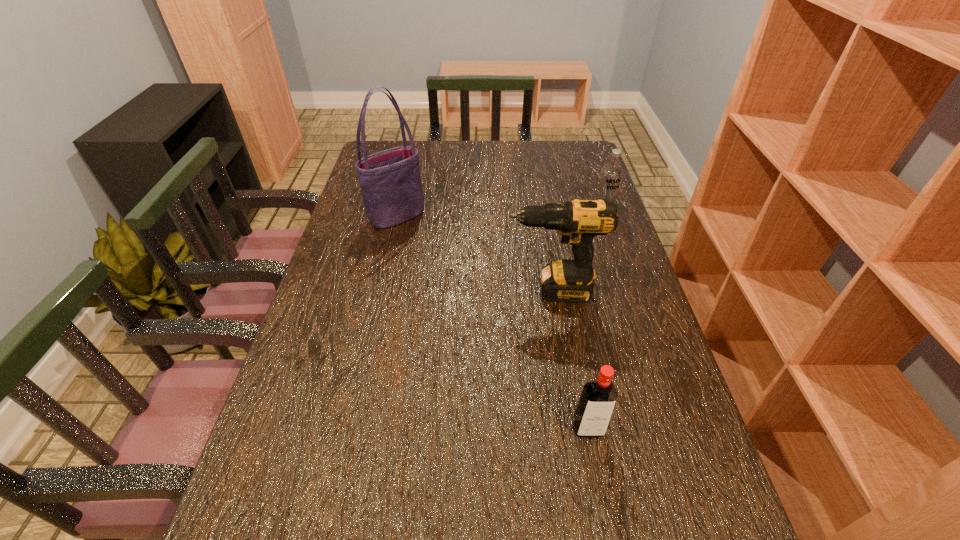
In the image, there is a desktop. Identify the location of free space at the far left corner. Image resolution: width=960 pixels, height=540 pixels. (375, 144).

Locate an element on the screen. vacant region at the far right corner of the desktop is located at coordinates (576, 159).

I want to click on free space between the rightmost object and the nearer vodka, so [x=595, y=321].

The image size is (960, 540). Identify the location of free space between the tallest object and the nearer vodka. (492, 322).

Locate an element on the screen. This screenshot has width=960, height=540. free space that is in between the right vodka and the nearest object is located at coordinates (595, 321).

This screenshot has height=540, width=960. In order to click on vacant point located between the leftmost object and the drill in this screenshot , I will do `click(474, 253)`.

In order to click on empty space between the nearest object and the farther vodka in this screenshot , I will do `click(595, 321)`.

The width and height of the screenshot is (960, 540). What are the coordinates of `free spot between the tallest object and the rightmost object` in the screenshot? It's located at (500, 214).

The height and width of the screenshot is (540, 960). I want to click on empty space that is in between the right vodka and the nearer vodka, so click(595, 321).

Locate an element on the screen. free space between the drill and the left vodka is located at coordinates (570, 360).